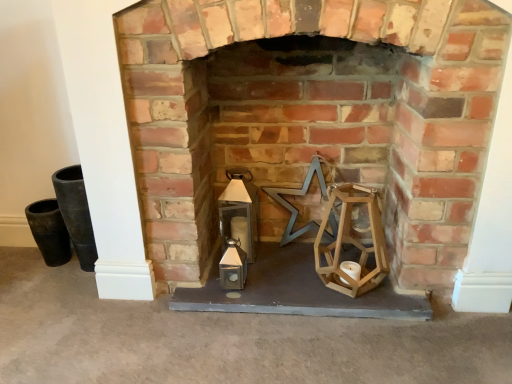
The width and height of the screenshot is (512, 384). Find the location of `free space in front of metallic lantern at center`. free space in front of metallic lantern at center is located at coordinates (313, 347).